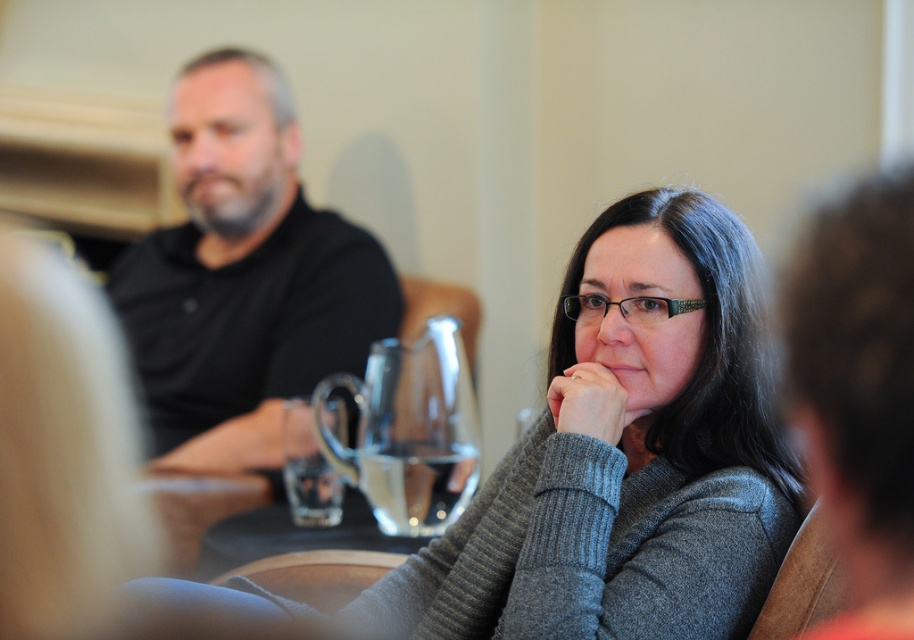
Between gray knitted sweater at center and transparent glass pitcher at center, which one has more height?

gray knitted sweater at center is taller.

Consider the image. Which is more to the right, gray knitted sweater at center or transparent glass pitcher at center?

Positioned to the right is gray knitted sweater at center.

Between point (636, 579) and point (438, 516), which one is positioned behind?

The point (438, 516) is behind.

Identify the location of gray knitted sweater at center. The image size is (914, 640). (625, 456).

Which is more to the right, black matte shirt at upper left or transparent glass pitcher at center?

From the viewer's perspective, transparent glass pitcher at center appears more on the right side.

Is black matte shirt at upper left wider than transparent glass pitcher at center?

Indeed, black matte shirt at upper left has a greater width compared to transparent glass pitcher at center.

Does point (260, 284) come farther from viewer compared to point (326, 385)?

Yes, it is behind point (326, 385).

This screenshot has height=640, width=914. Identify the location of black matte shirt at upper left. (242, 276).

Does gray knitted sweater at center have a lesser height compared to black matte shirt at upper left?

Indeed, gray knitted sweater at center has a lesser height compared to black matte shirt at upper left.

Who is more forward, (758, 522) or (328, 330)?

Point (758, 522) is in front.

The image size is (914, 640). In order to click on gray knitted sweater at center in this screenshot , I will do `click(625, 456)`.